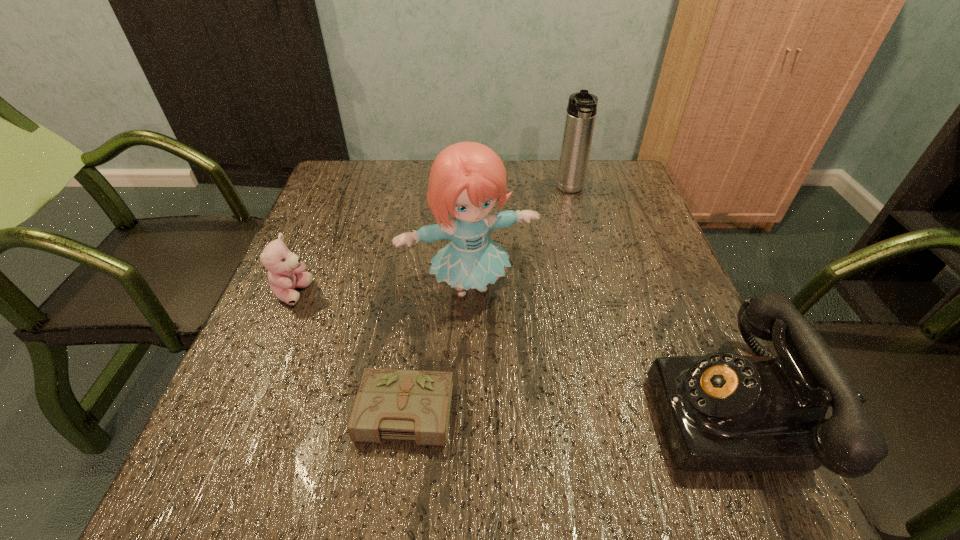
What are the coordinates of `free point at the left edge` in the screenshot? It's located at (255, 365).

In the image, there is a desktop. Identify the location of vacant space at the right edge. (642, 219).

Identify the location of vacant area at the far left corner. (372, 168).

You are a GUI agent. You are given a task and a screenshot of the screen. Output one action in this format:
    pyautogui.click(x=<x>, y=<y>)
    Task: Click on the vacant space at the far right corner of the desktop
    
    Given the screenshot: What is the action you would take?
    pyautogui.click(x=618, y=179)

You are a GUI agent. You are given a task and a screenshot of the screen. Output one action in this format:
    pyautogui.click(x=<x>, y=<y>)
    Task: Click on the vacant area that lies between the tallest object and the leftmost object
    This screenshot has height=540, width=960.
    Given the screenshot: What is the action you would take?
    381,291

Image resolution: width=960 pixels, height=540 pixels. In order to click on free space that is in between the farthest object and the tallest object in this screenshot , I will do `click(520, 239)`.

Locate an element on the screen. unoccupied area between the shortest object and the doll is located at coordinates (432, 349).

Image resolution: width=960 pixels, height=540 pixels. I want to click on empty location between the rightmost object and the leftmost object, so pos(512,352).

Find the location of a particular element. The image size is (960, 540). vacant space in between the farthest object and the diary is located at coordinates (483, 301).

Locate an element on the screen. The width and height of the screenshot is (960, 540). unoccupied area between the telephone and the teddy bear is located at coordinates (512, 352).